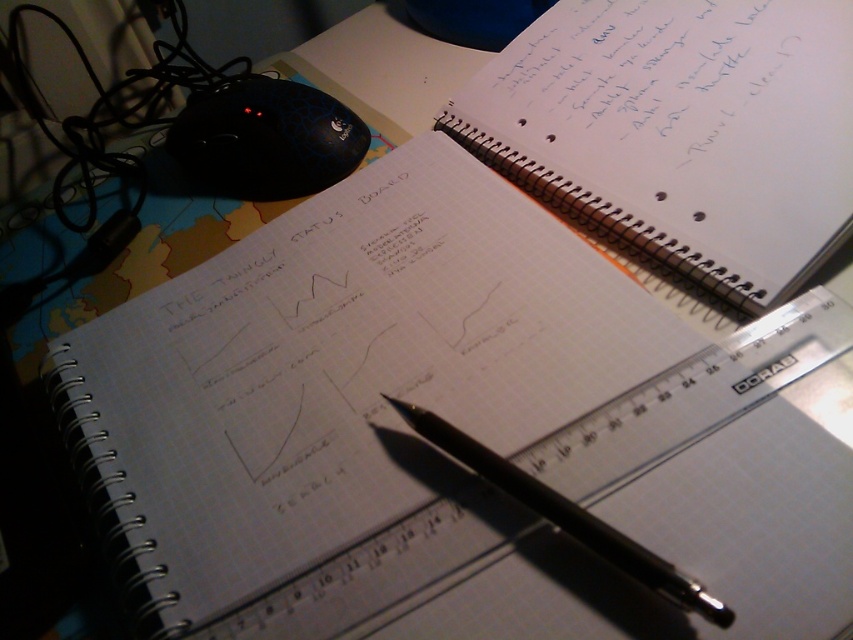
Can you confirm if white paper at upper right is positioned to the right of black metallic pen at center?

Correct, you'll find white paper at upper right to the right of black metallic pen at center.

Where is `white paper at upper right`? white paper at upper right is located at coordinates (682, 131).

Does point (624, 83) come closer to viewer compared to point (433, 420)?

No, (624, 83) is behind (433, 420).

The height and width of the screenshot is (640, 853). Identify the location of white paper at upper right. (682, 131).

Does point (664, 77) come in front of point (660, 32)?

Yes, point (664, 77) is in front of point (660, 32).

Which is behind, point (556, 204) or point (494, 68)?

The point (494, 68) is behind.

At what (x,y) coordinates should I click in order to perform the action: click on white paper at upper right. Please return your answer as a coordinate pair (x, y). The width and height of the screenshot is (853, 640). Looking at the image, I should click on (682, 131).

Which of these two, blue ink writing at upper right or black metallic pen at center, stands taller?

blue ink writing at upper right is taller.

Between blue ink writing at upper right and black metallic pen at center, which one is positioned higher?

blue ink writing at upper right

Is point (506, 93) positioned in front of point (444, 436)?

That is False.

The height and width of the screenshot is (640, 853). In order to click on blue ink writing at upper right in this screenshot , I will do `click(650, 81)`.